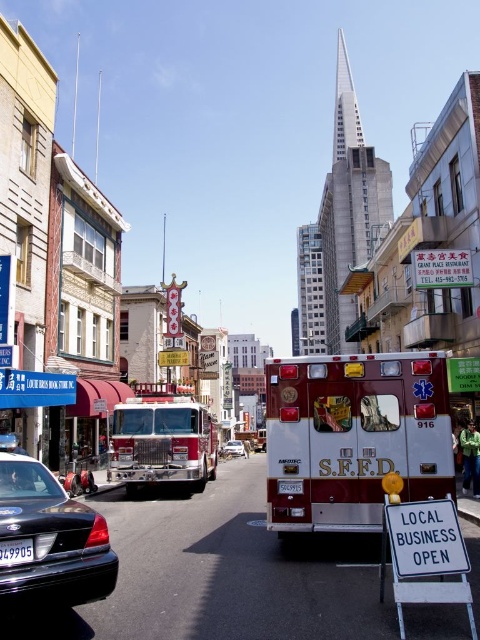
Question: Among these objects, which one is nearest to the camera?

Choices:
 (A) white glossy fire truck at center
 (B) shiny red fire truck at center

Answer: (A)

Question: Which of the following is the farthest from the observer?

Choices:
 (A) black glossy sedan at lower left
 (B) metallic silver car at center
 (C) shiny red fire truck at center
 (D) white plastic license plate at center

Answer: (B)

Question: Which object is closer to the camera taking this photo?

Choices:
 (A) white plastic license plate at center
 (B) white glossy fire truck at center
 (C) metallic silver car at center

Answer: (A)

Question: Observing the image, what is the correct spatial positioning of white glossy fire truck at center in reference to black glossy sedan at lower left?

Choices:
 (A) right
 (B) left

Answer: (A)

Question: Can you confirm if black glossy sedan at lower left is thinner than shiny red fire truck at center?

Choices:
 (A) no
 (B) yes

Answer: (B)

Question: Is white glossy fire truck at center bigger than white plastic license plate at center?

Choices:
 (A) no
 (B) yes

Answer: (B)